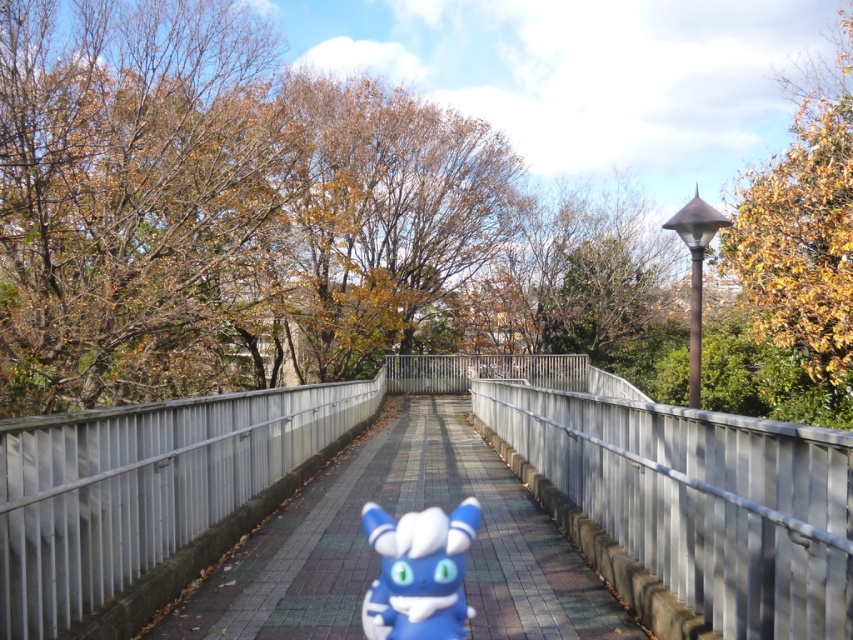
Question: Does smooth concrete walkway at center have a greater width compared to blue rubber toy at center?

Choices:
 (A) yes
 (B) no

Answer: (A)

Question: Is smooth concrete walkway at center further to camera compared to blue rubber toy at center?

Choices:
 (A) no
 (B) yes

Answer: (B)

Question: Which point is closer to the camera?

Choices:
 (A) smooth concrete walkway at center
 (B) metallic silver rail at center

Answer: (B)

Question: Among these points, which one is nearest to the camera?

Choices:
 (A) (576, 419)
 (B) (421, 588)
 (C) (33, 577)
 (D) (341, 461)

Answer: (B)

Question: Which object appears farthest from the camera in this image?

Choices:
 (A) smooth concrete walkway at center
 (B) metallic gray rail at center

Answer: (A)

Question: Is metallic gray rail at center smaller than blue rubber toy at center?

Choices:
 (A) no
 (B) yes

Answer: (A)